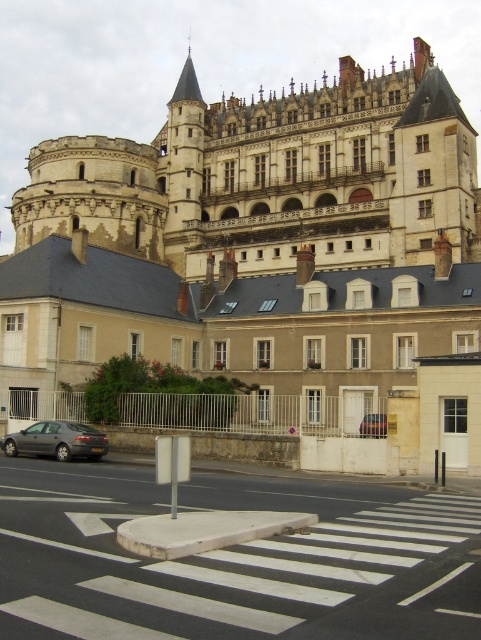
You are standing at the pedestrian crossing and want to take a photo of the historic building. There are two points marked in the image. The first point is at coordinates point (153,154), and the second is at point (86,572). Which point is closer to the historic building?

Point (153,154) is behind point (86,572), so the point closer to the historic building is point (153,154).

In the scene shown: You are standing at the pedestrian crossing and want to take a photo of the historic building. There are two points marked in the image, point A at coordinates point (68, 204) and point B at coordinates point (371, 432). Which point is closer to your camera lens when taking the photo?

Point A at coordinates point (68, 204) is closer to the camera lens than point B at coordinates point (371, 432) because it is further to the camera than the other point.